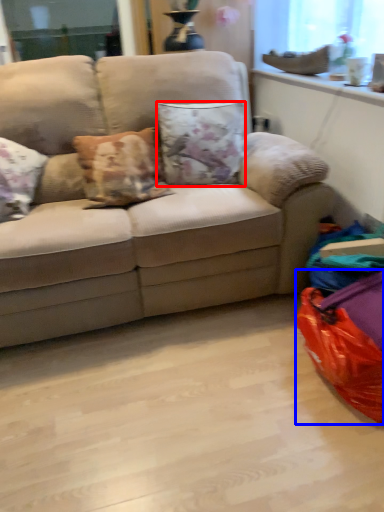
Question: Among these objects, which one is farthest to the camera, pillow (highlighted by a red box) or bean bag chair (highlighted by a blue box)?

Choices:
 (A) pillow
 (B) bean bag chair

Answer: (A)